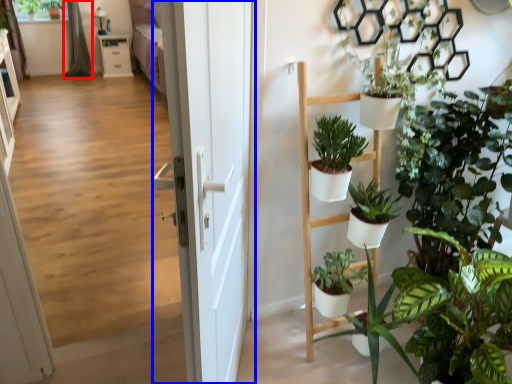
Question: Which of the following is the closest to the observer, curtain (highlighted by a red box) or door (highlighted by a blue box)?

Choices:
 (A) curtain
 (B) door

Answer: (B)